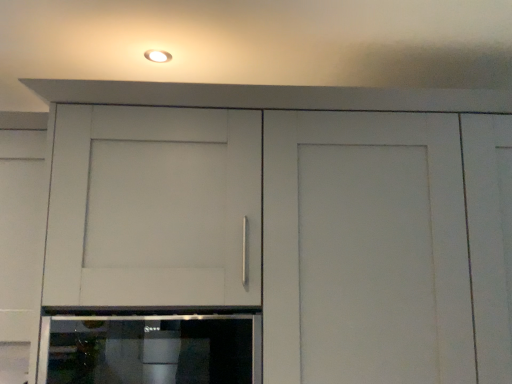
Where is `matte white light fixture at upper center`? matte white light fixture at upper center is located at coordinates (157, 56).

Describe the element at coordinates (157, 56) in the screenshot. I see `matte white light fixture at upper center` at that location.

Find the location of a particular element. sleek stainless steel oven at lower center is located at coordinates (153, 349).

What is the approximate width of sleek stainless steel oven at lower center?

sleek stainless steel oven at lower center is 12.98 inches in width.

The width and height of the screenshot is (512, 384). What do you see at coordinates (153, 349) in the screenshot?
I see `sleek stainless steel oven at lower center` at bounding box center [153, 349].

Locate an element on the screen. This screenshot has height=384, width=512. matte white light fixture at upper center is located at coordinates (157, 56).

Which is more to the left, sleek stainless steel oven at lower center or matte white light fixture at upper center?

From the viewer's perspective, matte white light fixture at upper center appears more on the left side.

Does sleek stainless steel oven at lower center lie behind matte white light fixture at upper center?

No, it is not.

Considering the positions of points (111, 324) and (148, 53), is point (111, 324) farther from camera compared to point (148, 53)?

No, (111, 324) is in front of (148, 53).

From the image's perspective, is sleek stainless steel oven at lower center located above matte white light fixture at upper center?

Answer: Incorrect, from the image's perspective, sleek stainless steel oven at lower center is lower than matte white light fixture at upper center.

From a real-world perspective, is sleek stainless steel oven at lower center over matte white light fixture at upper center?

No, from a real-world perspective, sleek stainless steel oven at lower center is not over matte white light fixture at upper center

Is sleek stainless steel oven at lower center thinner than matte white light fixture at upper center?

Incorrect, the width of sleek stainless steel oven at lower center is not less than that of matte white light fixture at upper center.

Is sleek stainless steel oven at lower center taller or shorter than matte white light fixture at upper center?

sleek stainless steel oven at lower center is taller than matte white light fixture at upper center.

Looking at the image, does sleek stainless steel oven at lower center seem bigger or smaller compared to matte white light fixture at upper center?

In the image, sleek stainless steel oven at lower center appears to be larger than matte white light fixture at upper center.

Is sleek stainless steel oven at lower center located outside matte white light fixture at upper center?

Yes.

Does sleek stainless steel oven at lower center touch matte white light fixture at upper center?

There is a gap between sleek stainless steel oven at lower center and matte white light fixture at upper center.

Is sleek stainless steel oven at lower center oriented away from matte white light fixture at upper center?

No, matte white light fixture at upper center is not at the back of sleek stainless steel oven at lower center.

Image resolution: width=512 pixels, height=384 pixels. I want to click on lighting above the sleek stainless steel oven at lower center (from the image's perspective), so click(157, 56).

In the scene shown: Is matte white light fixture at upper center at the right side of sleek stainless steel oven at lower center?

No.

Who is more distant, matte white light fixture at upper center or sleek stainless steel oven at lower center?

matte white light fixture at upper center is further away from the camera.

Is point (167, 60) less distant than point (152, 326)?

No, it is behind (152, 326).

From the picture: From the image's perspective, is matte white light fixture at upper center located beneath sleek stainless steel oven at lower center?

Actually, matte white light fixture at upper center appears above sleek stainless steel oven at lower center in the image.

From a real-world perspective, who is located higher, matte white light fixture at upper center or sleek stainless steel oven at lower center?

matte white light fixture at upper center is physically above.

Does matte white light fixture at upper center have a lesser width compared to sleek stainless steel oven at lower center?

Yes, matte white light fixture at upper center is thinner than sleek stainless steel oven at lower center.

Between matte white light fixture at upper center and sleek stainless steel oven at lower center, which one has more height?

sleek stainless steel oven at lower center is taller.

Considering the relative sizes of matte white light fixture at upper center and sleek stainless steel oven at lower center in the image provided, is matte white light fixture at upper center bigger than sleek stainless steel oven at lower center?

No.

Is matte white light fixture at upper center positioned beyond the bounds of sleek stainless steel oven at lower center?

Yes, matte white light fixture at upper center is outside of sleek stainless steel oven at lower center.

Is matte white light fixture at upper center in contact with sleek stainless steel oven at lower center?

No, matte white light fixture at upper center is not next to sleek stainless steel oven at lower center.

In the scene shown: Is matte white light fixture at upper center facing away from sleek stainless steel oven at lower center?

No, matte white light fixture at upper center's orientation is not away from sleek stainless steel oven at lower center.

The width and height of the screenshot is (512, 384). In order to click on lighting that appears above the sleek stainless steel oven at lower center (from a real-world perspective) in this screenshot , I will do point(157,56).

Image resolution: width=512 pixels, height=384 pixels. Identify the location of lighting above the sleek stainless steel oven at lower center (from the image's perspective). (157, 56).

What are the coordinates of `lighting located on the left of sleek stainless steel oven at lower center` in the screenshot? It's located at (x=157, y=56).